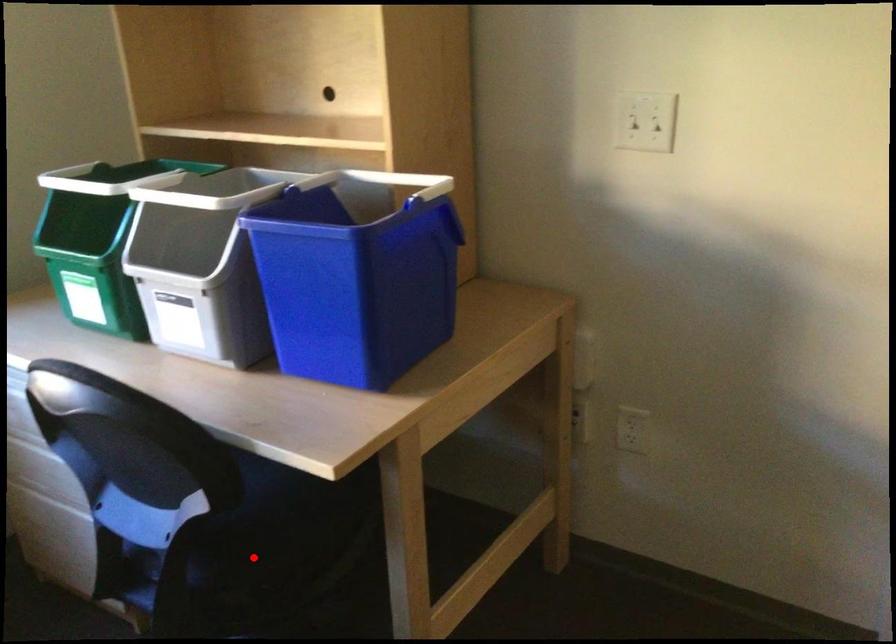
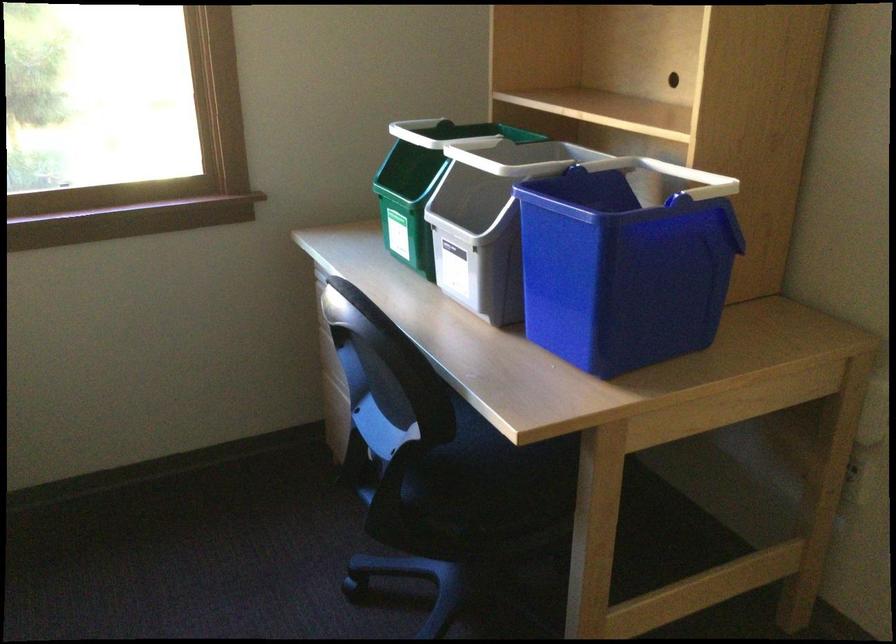
Where in the second image is the point corresponding to the highlighted location from the first image?

(460, 494)